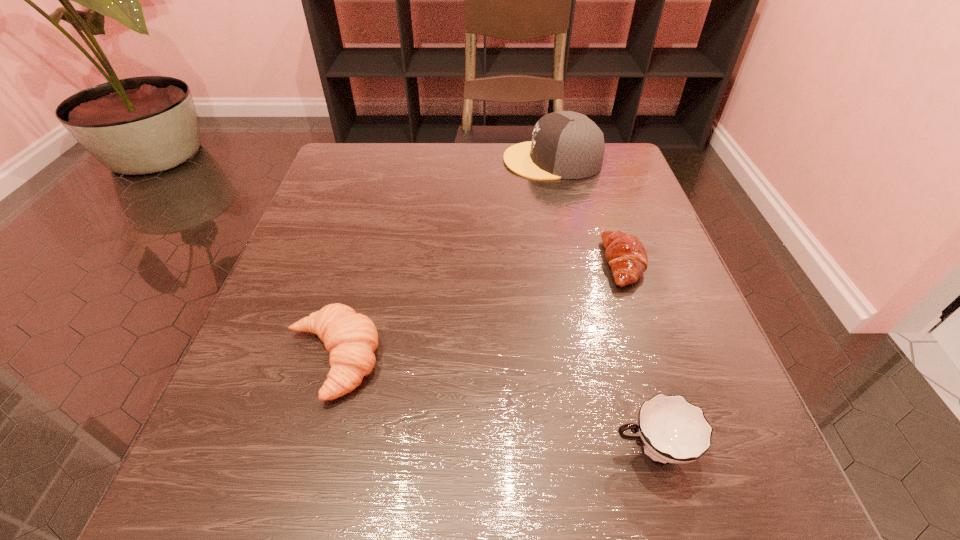
At what (x,y) coordinates should I click in order to perform the action: click on vacant space that satisfies the following two spatial constraints: 1. on the front-facing side of the farthest object; 2. on the side of the cup with the handle. Please return your answer as a coordinate pair (x, y). This screenshot has width=960, height=540. Looking at the image, I should click on (616, 449).